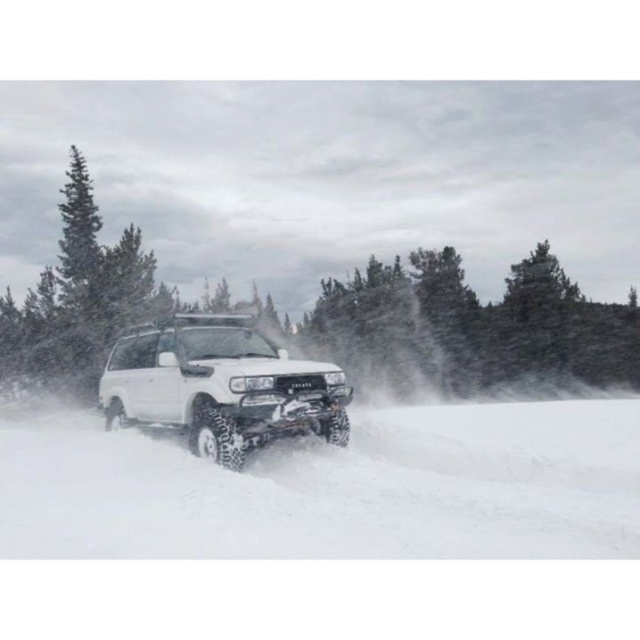
Between point (106, 435) and point (216, 396), which one is positioned behind?

Positioned behind is point (106, 435).

Is white fluffy snow at center positioned in front of white matte suv at center?

Yes, white fluffy snow at center is closer to the viewer.

What do you see at coordinates (339, 488) in the screenshot? This screenshot has width=640, height=640. I see `white fluffy snow at center` at bounding box center [339, 488].

Locate an element on the screen. white fluffy snow at center is located at coordinates (339, 488).